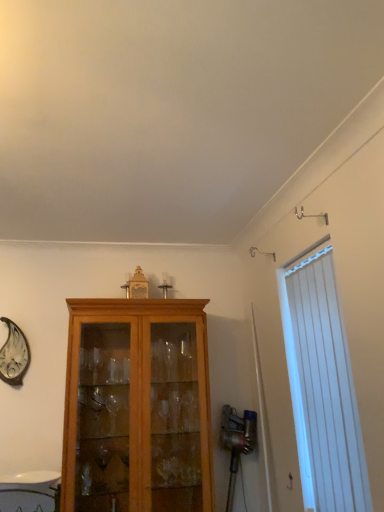
Question: Is white vertical blinds at right taller or shorter than light brown wood cabinet at center?

Choices:
 (A) short
 (B) tall

Answer: (A)

Question: Considering the positions of white vertical blinds at right and light brown wood cabinet at center in the image, is white vertical blinds at right bigger or smaller than light brown wood cabinet at center?

Choices:
 (A) small
 (B) big

Answer: (A)

Question: Relative to light brown wood cabinet at center, is white vertical blinds at right in front or behind?

Choices:
 (A) behind
 (B) front

Answer: (B)

Question: Is light brown wood cabinet at center wider or thinner than white vertical blinds at right?

Choices:
 (A) thin
 (B) wide

Answer: (B)

Question: Considering the relative positions of light brown wood cabinet at center and white vertical blinds at right in the image provided, is light brown wood cabinet at center to the left or to the right of white vertical blinds at right?

Choices:
 (A) right
 (B) left

Answer: (B)

Question: Is light brown wood cabinet at center in front of or behind white vertical blinds at right in the image?

Choices:
 (A) front
 (B) behind

Answer: (B)

Question: Is light brown wood cabinet at center taller or shorter than white vertical blinds at right?

Choices:
 (A) short
 (B) tall

Answer: (B)